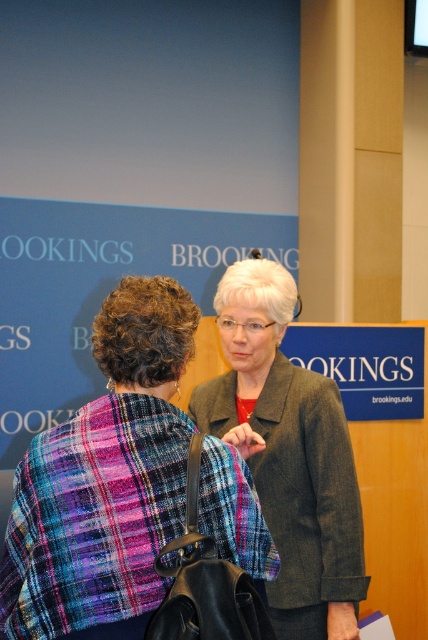
Question: Which object appears closest to the camera in this image?

Choices:
 (A) matte brown blazer at center
 (B) plaid fabric shawl at center

Answer: (B)

Question: Is plaid fabric shawl at center thinner than matte brown blazer at center?

Choices:
 (A) no
 (B) yes

Answer: (A)

Question: Which point is farther to the camera?

Choices:
 (A) matte brown blazer at center
 (B) plaid fabric shawl at center

Answer: (A)

Question: Can you confirm if plaid fabric shawl at center is bigger than matte brown blazer at center?

Choices:
 (A) no
 (B) yes

Answer: (A)

Question: From the image, what is the correct spatial relationship of plaid fabric shawl at center in relation to matte brown blazer at center?

Choices:
 (A) above
 (B) below

Answer: (A)